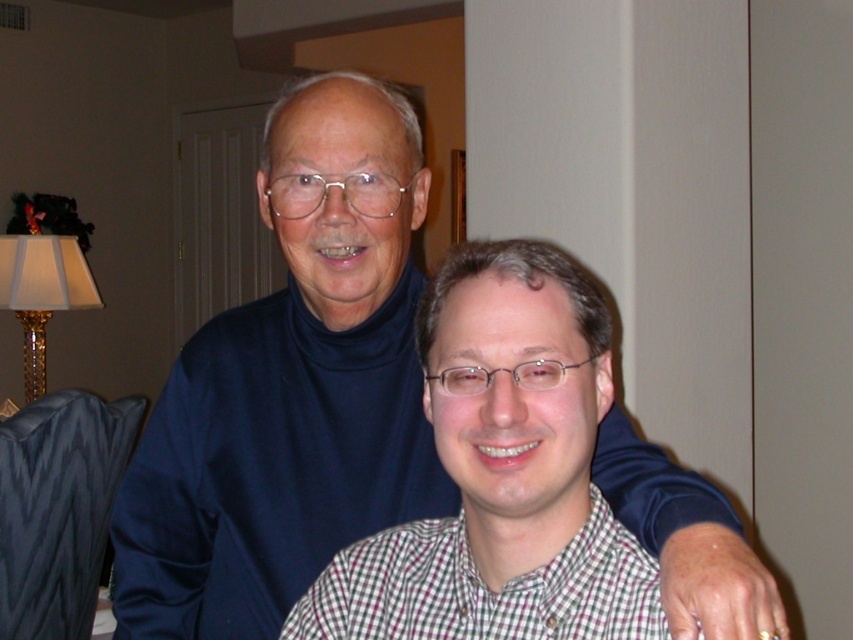
Question: Which point is closer to the camera?

Choices:
 (A) checkered shirt at center
 (B) dark blue turtleneck sweater at upper center

Answer: (B)

Question: Is dark blue turtleneck sweater at upper center to the right of checkered shirt at center from the viewer's perspective?

Choices:
 (A) yes
 (B) no

Answer: (B)

Question: Which of the following is the farthest from the observer?

Choices:
 (A) checkered shirt at center
 (B) dark blue turtleneck sweater at upper center

Answer: (A)

Question: Is dark blue turtleneck sweater at upper center to the right of checkered shirt at center from the viewer's perspective?

Choices:
 (A) no
 (B) yes

Answer: (A)

Question: Among these objects, which one is nearest to the camera?

Choices:
 (A) dark blue turtleneck sweater at upper center
 (B) checkered shirt at center

Answer: (A)

Question: Can you confirm if dark blue turtleneck sweater at upper center is positioned above checkered shirt at center?

Choices:
 (A) no
 (B) yes

Answer: (A)